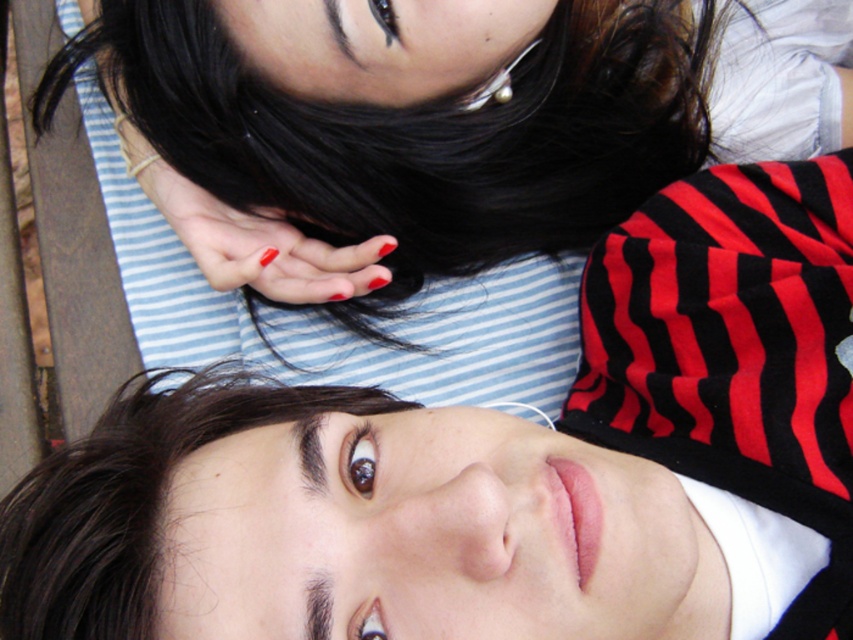
Question: Does dark brown shiny hair at upper center have a smaller size compared to glossy nail polish at center?

Choices:
 (A) no
 (B) yes

Answer: (A)

Question: Among these points, which one is nearest to the camera?

Choices:
 (A) (250, 250)
 (B) (309, 390)

Answer: (B)

Question: Can you confirm if dark brown shiny hair at upper center is positioned to the right of glossy nail polish at center?

Choices:
 (A) no
 (B) yes

Answer: (A)

Question: Does dark brown shiny hair at upper center appear under glossy nail polish at center?

Choices:
 (A) no
 (B) yes

Answer: (B)